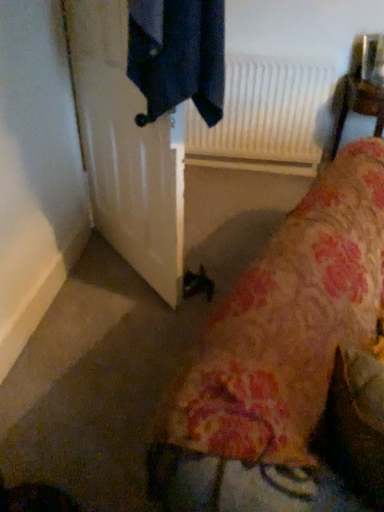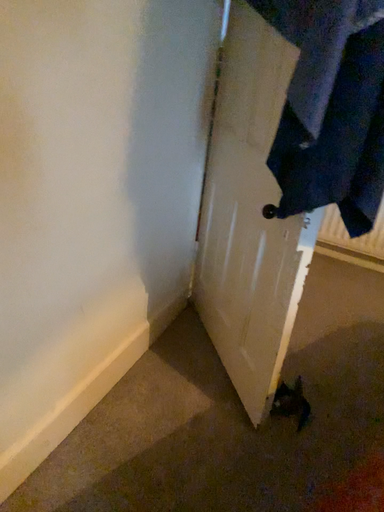
Question: How did the camera likely rotate when shooting the video?

Choices:
 (A) rotated left
 (B) rotated right

Answer: (A)